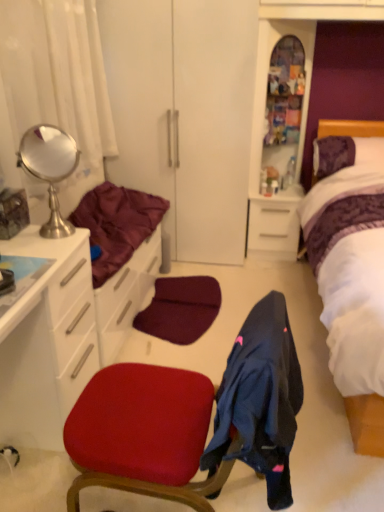
Describe the element at coordinates (350, 128) in the screenshot. This screenshot has height=512, width=384. I see `purple fabric headboard at upper right` at that location.

Looking at this image, measure the distance between polished silver mirror at upper left and camera.

The distance of polished silver mirror at upper left from camera is 5.07 feet.

Image resolution: width=384 pixels, height=512 pixels. Identify the location of white glossy cabinet at left. (47, 340).

The width and height of the screenshot is (384, 512). What do you see at coordinates (192, 418) in the screenshot?
I see `velvet red chair at center` at bounding box center [192, 418].

Find the location of a particular element. The height and width of the screenshot is (512, 384). white glossy drawer at center is located at coordinates (273, 226).

The image size is (384, 512). What do you see at coordinates (260, 399) in the screenshot? I see `dark blue fabric coat at center` at bounding box center [260, 399].

Image resolution: width=384 pixels, height=512 pixels. I want to click on white sheer curtain at upper left, so click(57, 83).

The height and width of the screenshot is (512, 384). I want to click on purple fabric headboard at upper right, so click(x=350, y=128).

In terms of height, does dark blue fabric coat at center look taller or shorter compared to purple satin bed at right?

dark blue fabric coat at center is shorter than purple satin bed at right.

Locate an element on the screen. The image size is (384, 512). clothing on the left of purple satin bed at right is located at coordinates (260, 399).

Is point (230, 440) closer or farther from the camera than point (354, 123)?

Point (230, 440) is closer to the camera than point (354, 123).

Between dark blue fabric coat at center and purple satin bed at right, which one has smaller width?

dark blue fabric coat at center is thinner.

Is purple fabric headboard at upper right inside or outside of white glossy drawer at center?

purple fabric headboard at upper right exists outside the volume of white glossy drawer at center.

Between point (377, 132) and point (292, 251), which one is positioned behind?

The point (292, 251) is farther.

Which of these two, purple fabric headboard at upper right or white glossy drawer at center, is bigger?

With larger size is white glossy drawer at center.

What are the coordinates of `bedding above the white glossy cabinet at left (from a real-world perspective)` in the screenshot? It's located at (116, 224).

Looking at this image, considering the relative sizes of maroon satin blanket at left and white glossy cabinet at left in the image provided, is maroon satin blanket at left shorter than white glossy cabinet at left?

Correct, maroon satin blanket at left is not as tall as white glossy cabinet at left.

Who is more distant, maroon satin blanket at left or white glossy cabinet at left?

maroon satin blanket at left is more distant.

Is white glossy cabinet at left completely or partially inside maroon satin blanket at left?

No, maroon satin blanket at left does not contain white glossy cabinet at left.

Does purple fabric headboard at upper right have a smaller size compared to purple satin bed at right?

Indeed, purple fabric headboard at upper right has a smaller size compared to purple satin bed at right.

Is purple fabric headboard at upper right aimed at purple satin bed at right?

Yes, purple fabric headboard at upper right is turned towards purple satin bed at right.

In the image, there is a purple fabric headboard at upper right. Identify the location of bed below it (from a real-world perspective). (366, 423).

Is purple fabric headboard at upper right placed right next to purple satin bed at right?

Yes, purple fabric headboard at upper right is in contact with purple satin bed at right.

Does white glossy cabinet at left have a larger size compared to dark blue fabric coat at center?

Correct, white glossy cabinet at left is larger in size than dark blue fabric coat at center.

Is white glossy cabinet at left not close to dark blue fabric coat at center?

No, there isn't a large distance between white glossy cabinet at left and dark blue fabric coat at center.

Considering the sizes of objects white glossy cabinet at left and dark blue fabric coat at center in the image provided, who is shorter, white glossy cabinet at left or dark blue fabric coat at center?

dark blue fabric coat at center is shorter.

Is white glossy cabinet at left turned away from dark blue fabric coat at center?

That's not correct — white glossy cabinet at left is not looking away from dark blue fabric coat at center.

Considering the sizes of wooden cabinet at upper right and velvet red chair at center in the image, is wooden cabinet at upper right taller or shorter than velvet red chair at center?

wooden cabinet at upper right is taller than velvet red chair at center.

Which is more to the left, wooden cabinet at upper right or velvet red chair at center?

velvet red chair at center.

Does wooden cabinet at upper right have a smaller size compared to velvet red chair at center?

Yes.

Which object is closer to the camera taking this photo, wooden cabinet at upper right or velvet red chair at center?

Positioned in front is velvet red chair at center.

Does polished silver mirror at upper left turn towards velvet red chair at center?

No, polished silver mirror at upper left is not oriented towards velvet red chair at center.

Does polished silver mirror at upper left appear on the left side of velvet red chair at center?

Yes.

How many degrees apart are the facing directions of polished silver mirror at upper left and velvet red chair at center?

There is a 131-degree angle between the facing directions of polished silver mirror at upper left and velvet red chair at center.

You are a GUI agent. You are given a task and a screenshot of the screen. Output one action in this format:
    pyautogui.click(x=<x>, y=<y>)
    Task: Click on the chair on the right of polished silver mirror at upper left
    The width and height of the screenshot is (384, 512).
    Given the screenshot: What is the action you would take?
    pyautogui.click(x=192, y=418)

Find the location of a particular element. The width and height of the screenshot is (384, 512). clothing on the left of purple satin bed at right is located at coordinates (260, 399).

Where is `headboard to the right of white glossy drawer at center`? This screenshot has height=512, width=384. headboard to the right of white glossy drawer at center is located at coordinates (350, 128).

From the image, which object appears to be farther from velvet red chair at center, maroon satin blanket at left or dark blue fabric coat at center?

The object further to velvet red chair at center is maroon satin blanket at left.

When comparing their distances from wooden cabinet at upper right, does white glossy drawer at center or white glossy cabinet at left seem further?

white glossy cabinet at left is positioned further to the anchor wooden cabinet at upper right.

From the image, which object appears to be farther from polished silver mirror at upper left, purple satin bed at right or white glossy drawer at center?

Among the two, purple satin bed at right is located further to polished silver mirror at upper left.

Which object lies nearer to the anchor point velvet red chair at center, maroon satin blanket at left or purple fabric headboard at upper right?

Among the two, maroon satin blanket at left is located nearer to velvet red chair at center.

Based on their spatial positions, is purple fabric headboard at upper right or dark blue fabric coat at center closer to maroon satin blanket at left?

The object closer to maroon satin blanket at left is dark blue fabric coat at center.

Based on their spatial positions, is white sheer curtain at upper left or polished silver mirror at upper left further from purple fabric headboard at upper right?

The object further to purple fabric headboard at upper right is polished silver mirror at upper left.

From the image, which object appears to be nearer to wooden cabinet at upper right, white glossy drawer at center or maroon satin blanket at left?

white glossy drawer at center.

Looking at the image, which one is located closer to dark blue fabric coat at center, wooden cabinet at upper right or velvet red chair at center?

velvet red chair at center is closer to dark blue fabric coat at center.

Locate an element on the screen. bed between white sheer curtain at upper left and purple fabric headboard at upper right is located at coordinates (366, 423).

At what (x,y) coordinates should I click in order to perform the action: click on file cabinet between white sheer curtain at upper left and purple fabric headboard at upper right from left to right. Please return your answer as a coordinate pair (x, y). This screenshot has height=512, width=384. Looking at the image, I should click on (263, 149).

Where is `file cabinet located between white glossy cabinet at left and white glossy drawer at center in the depth direction`? This screenshot has width=384, height=512. file cabinet located between white glossy cabinet at left and white glossy drawer at center in the depth direction is located at coordinates (263, 149).

Locate an element on the screen. This screenshot has width=384, height=512. mirror located between velvet red chair at center and purple fabric headboard at upper right in the depth direction is located at coordinates (50, 169).